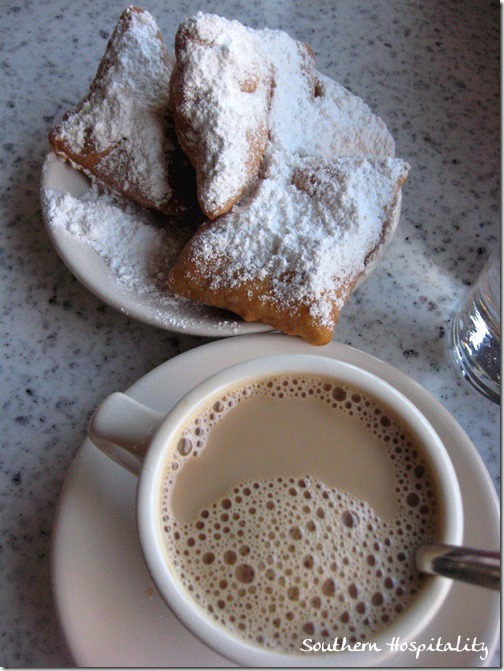
Where is `glass`? The width and height of the screenshot is (504, 671). glass is located at coordinates (488, 345).